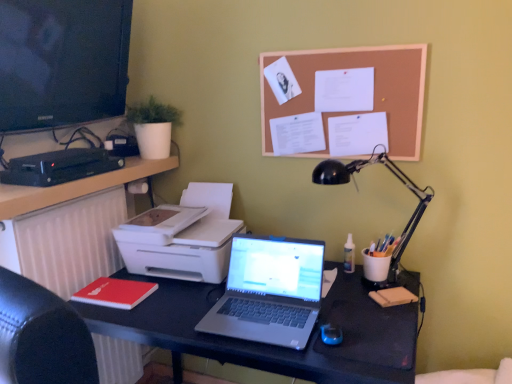
This screenshot has width=512, height=384. Find the location of `free space in front of white plastic printer at left`. free space in front of white plastic printer at left is located at coordinates (161, 304).